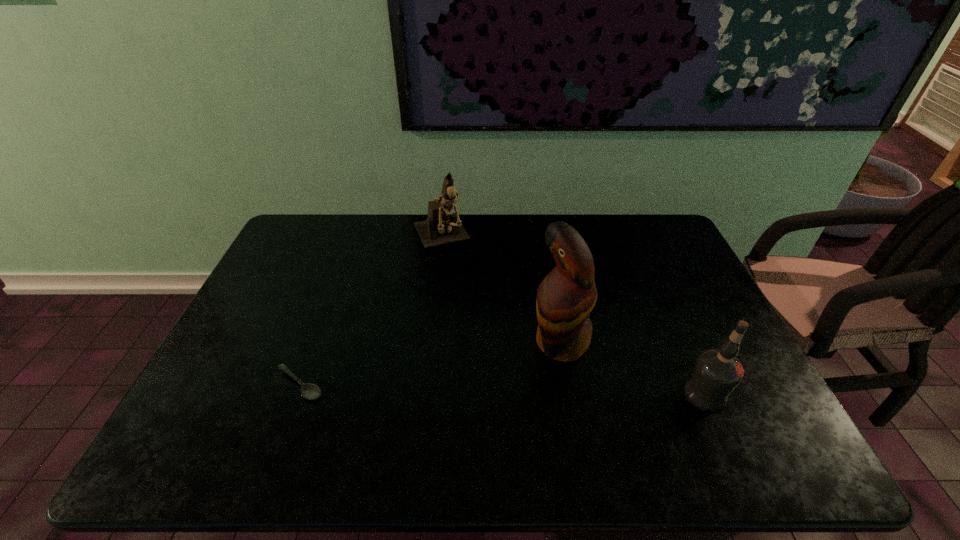
At what (x,y) coordinates should I click in order to perform the action: click on vacant space on the desktop that is between the leftmost object and the third tallest object and is positioned on the face of the tallest object. Please return your answer as a coordinate pair (x, y). Image resolution: width=960 pixels, height=540 pixels. Looking at the image, I should click on coord(472,389).

Where is `vacant space on the desktop that is between the shortest object and the vodka and is positioned on the front-facing side of the third shortest object`? Image resolution: width=960 pixels, height=540 pixels. vacant space on the desktop that is between the shortest object and the vodka and is positioned on the front-facing side of the third shortest object is located at coordinates (517, 390).